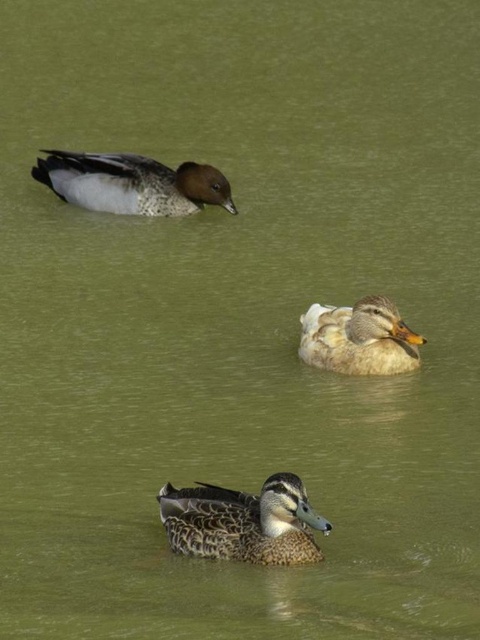
In the image of the three ducks swimming in greenish water, there are two ducks at the center. The speckled feathered duck at center and the white fluffy duck at center. Which one is positioned to the left?

The speckled feathered duck at center is positioned to the left of the white fluffy duck at center.

You are observing two ducks in the water. The speckled feathered duck at center and the speckled feathered duck at upper left. Which duck is closer to you?

The speckled feathered duck at center is closer to you because it is positioned in the foreground of the scene.